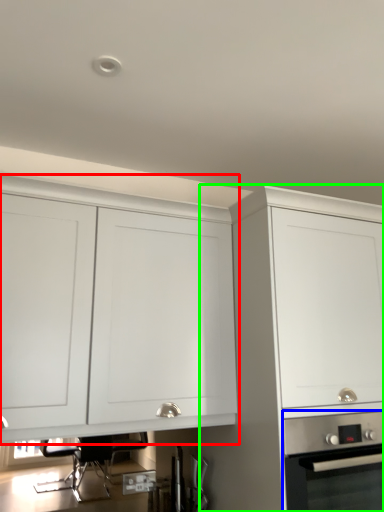
Question: Considering the real-world distances, which object is closest to cabinetry (highlighted by a red box)? home appliance (highlighted by a blue box) or cabinetry (highlighted by a green box).

Choices:
 (A) home appliance
 (B) cabinetry

Answer: (B)